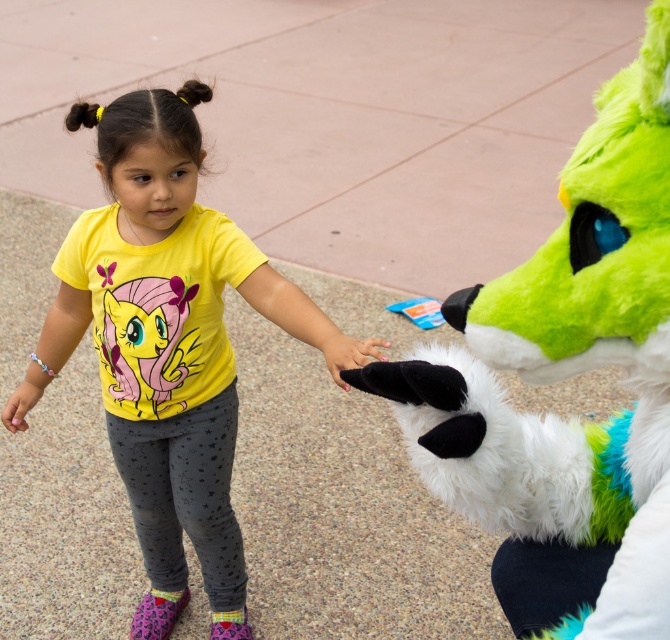
Does point (549, 604) lie in front of point (385, 344)?

Yes, it is in front of point (385, 344).

Where is `fluffy green and white plush toy at right`? fluffy green and white plush toy at right is located at coordinates (563, 378).

Locate an element on the screen. fluffy green and white plush toy at right is located at coordinates (563, 378).

In order to click on fluffy green and white plush toy at right in this screenshot , I will do `click(563, 378)`.